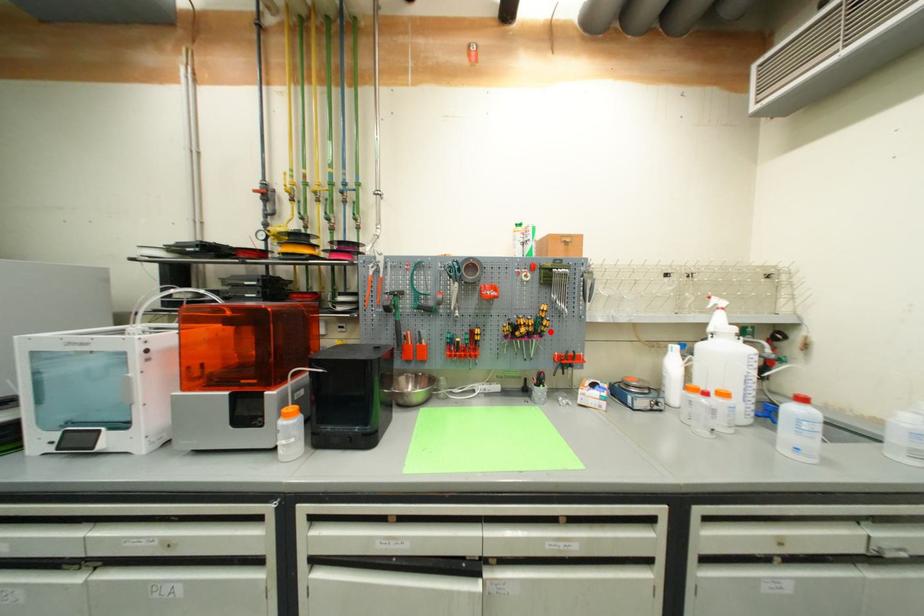
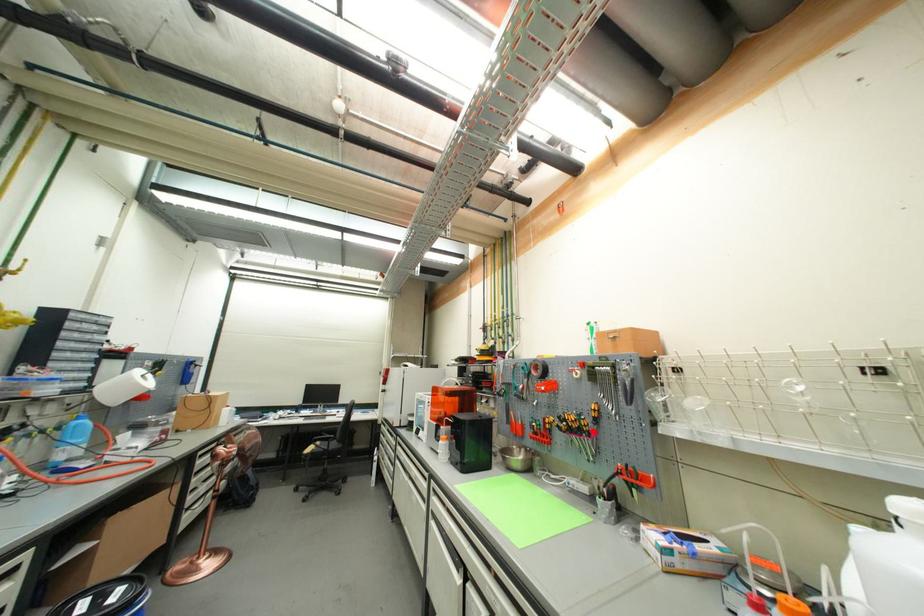
I am providing you with two images of the same scene from different viewpoints. A red point is marked on the first image and another point is marked on the second image. Is the red point in image1 aligned with the point shown in image2?

Yes